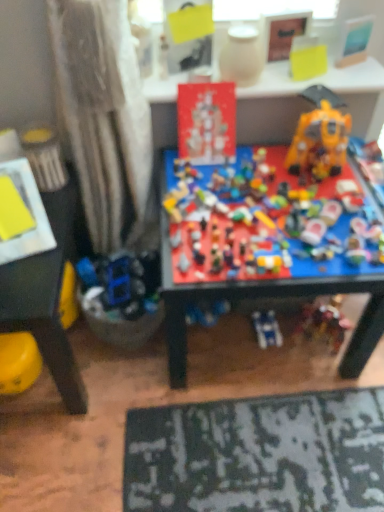
Find the location of `empty space that is to the right of yellow matte paper at upper center, positioned as the 5th toy in left-to-right order`. empty space that is to the right of yellow matte paper at upper center, positioned as the 5th toy in left-to-right order is located at coordinates (354, 71).